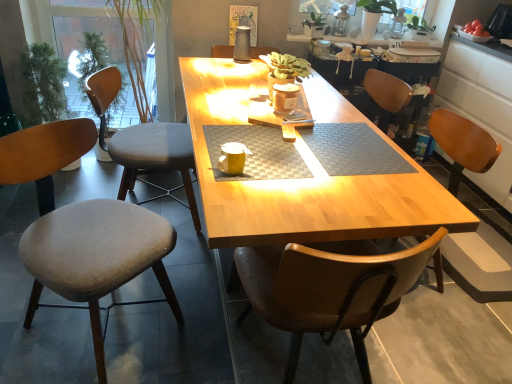
Question: Is green matte plant at upper right shorter than yellow matte coffee cup at center?

Choices:
 (A) no
 (B) yes

Answer: (A)

Question: Is yellow matte coffee cup at center located within green matte plant at upper right?

Choices:
 (A) yes
 (B) no

Answer: (B)

Question: Is green matte plant at upper right placed right next to yellow matte coffee cup at center?

Choices:
 (A) yes
 (B) no

Answer: (B)

Question: Is green matte plant at upper right thinner than yellow matte coffee cup at center?

Choices:
 (A) yes
 (B) no

Answer: (B)

Question: Is green matte plant at upper right to the left of yellow matte coffee cup at center from the viewer's perspective?

Choices:
 (A) no
 (B) yes

Answer: (A)

Question: Can you confirm if green matte plant at upper right is wider than yellow matte coffee cup at center?

Choices:
 (A) yes
 (B) no

Answer: (A)

Question: Does green matte plant at upper right have a lesser width compared to wooden table at center?

Choices:
 (A) yes
 (B) no

Answer: (A)

Question: Is wooden table at center at the back of green matte plant at upper right?

Choices:
 (A) yes
 (B) no

Answer: (B)

Question: Is the position of green matte plant at upper right less distant than that of wooden table at center?

Choices:
 (A) no
 (B) yes

Answer: (A)

Question: Is green matte plant at upper right at the right side of wooden table at center?

Choices:
 (A) yes
 (B) no

Answer: (A)

Question: Is green matte plant at upper right bigger than wooden table at center?

Choices:
 (A) yes
 (B) no

Answer: (B)

Question: Are green matte plant at upper right and wooden table at center beside each other?

Choices:
 (A) yes
 (B) no

Answer: (B)

Question: Is gray fabric chair at left, arranged as the 2th chair when viewed from the right, at the left side of wooden table at center?

Choices:
 (A) yes
 (B) no

Answer: (A)